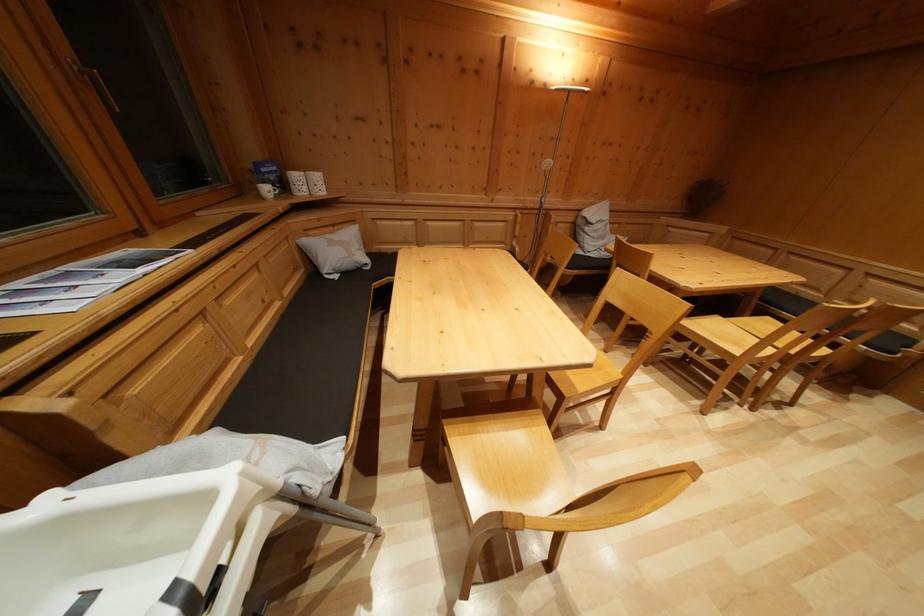
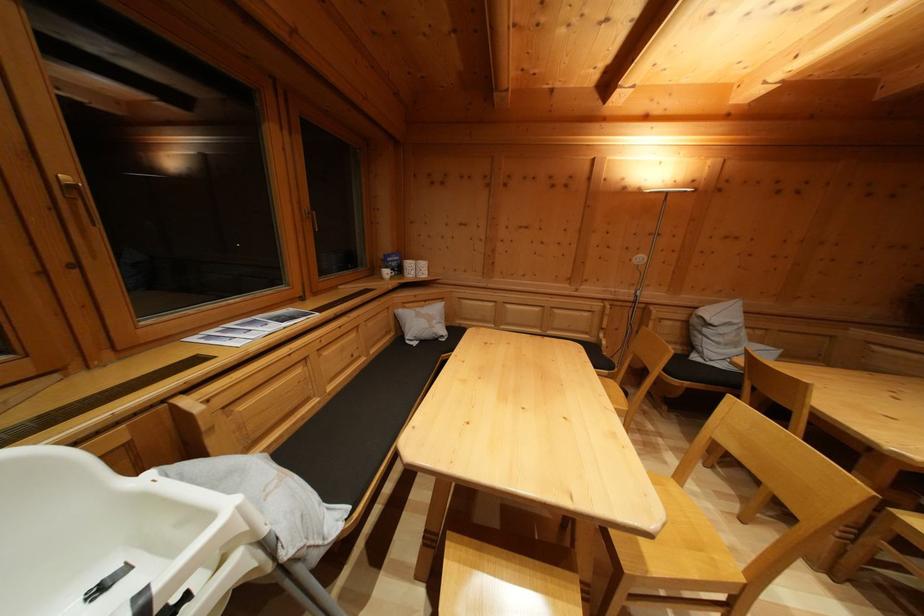
The point at (x=591, y=235) is marked in the first image. Where is the corresponding point in the second image?

(711, 337)